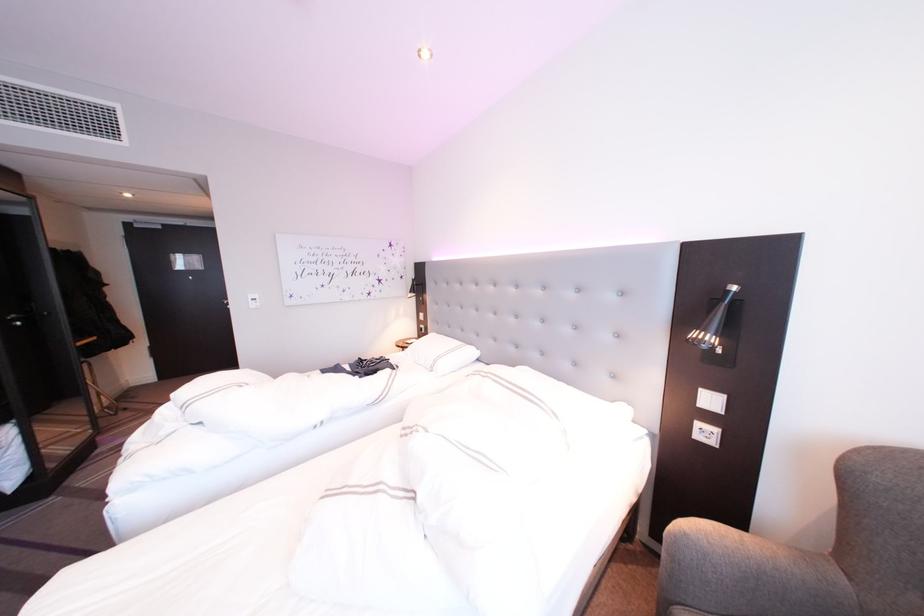
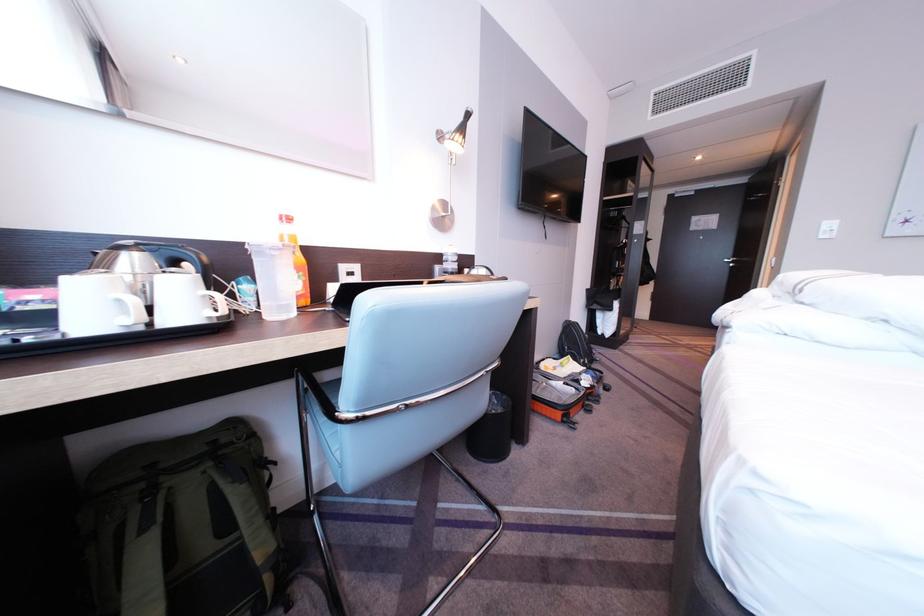
Where in the second image is the point corresponding to point (199, 408) from the first image?

(820, 285)